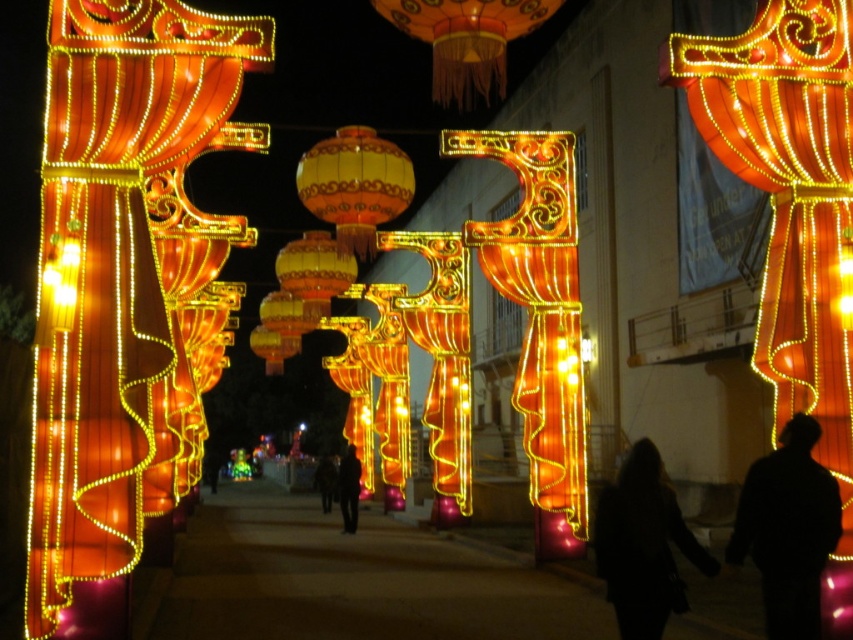
You are a drone operator tasked with capturing aerial footage of the festive scene. Your drone has a maximum flight range of 15 meters. You need to fly from the matte orange fabric lantern at left to the matte orange paper lantern at upper center. Can your drone complete this flight without exceeding its range?

The matte orange fabric lantern at left is 17.90 meters from the matte orange paper lantern at upper center. Since the drone has a maximum range of 15 meters, it cannot complete the flight without exceeding its range.

You are standing in the festive scene and want to place a new decorative item between the black fabric at lower right and the matte yellow lantern at center. Based on their positions, which object should you place it closer to?

The black fabric at lower right is to the right of the matte yellow lantern at center, so placing the new decorative item closer to the matte yellow lantern at center would position it between them.